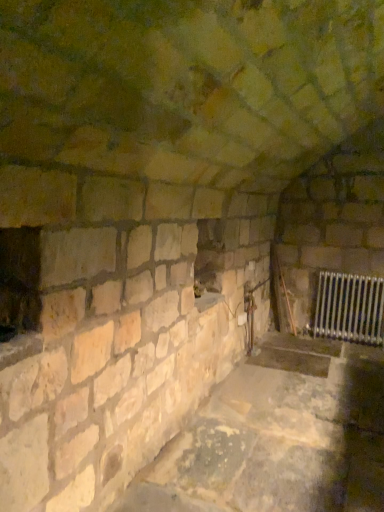
The image size is (384, 512). Find the location of `free spot above silver metallic radiator at right (from a real-world perspective)`. free spot above silver metallic radiator at right (from a real-world perspective) is located at coordinates (354, 274).